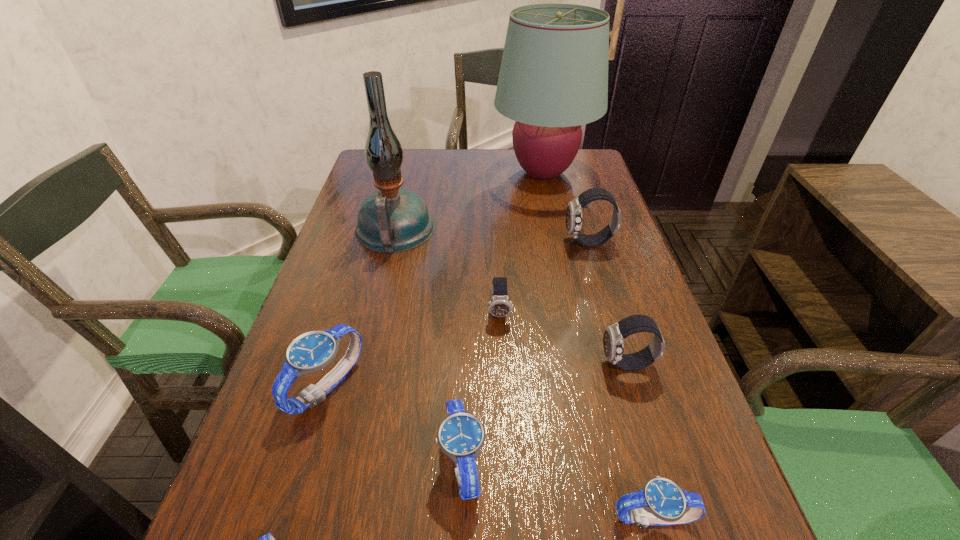
Where is `the smallest dark watch`? The width and height of the screenshot is (960, 540). the smallest dark watch is located at coordinates (499, 306).

Where is `vacant space located 0.150m on the left of the farthest object`? This screenshot has width=960, height=540. vacant space located 0.150m on the left of the farthest object is located at coordinates (445, 173).

Where is `vacant space located 0.120m on the back of the oil lamp`? The width and height of the screenshot is (960, 540). vacant space located 0.120m on the back of the oil lamp is located at coordinates (406, 185).

Find the location of a particular element. Image resolution: width=960 pixels, height=540 pixels. vacant space situated on the face of the seventh shortest object is located at coordinates (530, 242).

Locate an element on the screen. The width and height of the screenshot is (960, 540). free region located on the face of the seventh shortest object is located at coordinates (541, 242).

At what (x,y) coordinates should I click in order to perform the action: click on vacant space situated on the face of the seventh shortest object. Please return your answer as a coordinate pair (x, y). Image resolution: width=960 pixels, height=540 pixels. Looking at the image, I should click on (502, 242).

This screenshot has width=960, height=540. What are the coordinates of `vacant region located 0.270m on the face of the nearest dark watch` in the screenshot? It's located at (462, 364).

Locate an element on the screen. The image size is (960, 540). vacant region located 0.080m on the face of the nearest dark watch is located at coordinates (560, 364).

Find the location of a particular element. free location located 0.320m on the face of the nearest dark watch is located at coordinates (436, 364).

You are a GUI agent. You are given a task and a screenshot of the screen. Output one action in this format:
    pyautogui.click(x=<x>, y=<y>)
    Task: Click on the vacant region located 0.070m on the right of the biggest blue watch
    The height and width of the screenshot is (540, 960).
    Given the screenshot: What is the action you would take?
    pyautogui.click(x=397, y=386)